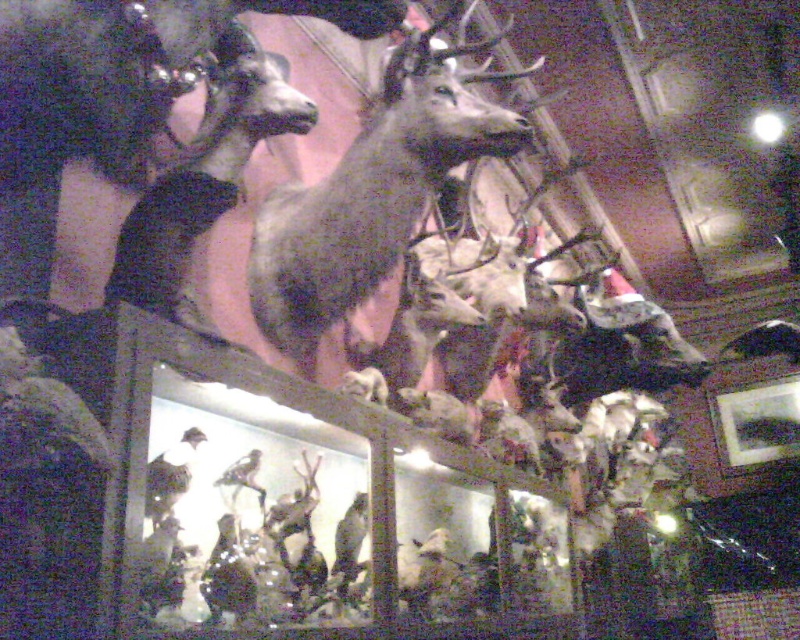
Question: Can you confirm if shiny brown deer at center is thinner than shiny brown deer at upper left?

Choices:
 (A) no
 (B) yes

Answer: (A)

Question: Can you confirm if shiny brown deer at center is bigger than shiny brown deer at upper left?

Choices:
 (A) yes
 (B) no

Answer: (A)

Question: Among these objects, which one is farthest from the camera?

Choices:
 (A) shiny brown deer at upper left
 (B) shiny brown deer at center

Answer: (B)

Question: Does shiny brown deer at center have a greater width compared to shiny brown deer at upper left?

Choices:
 (A) yes
 (B) no

Answer: (A)